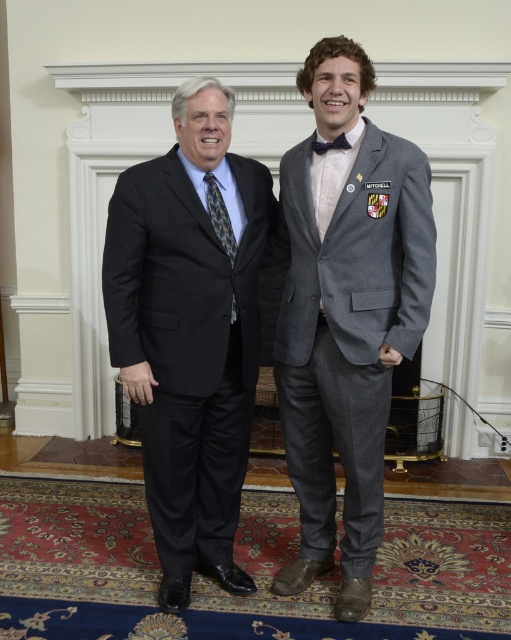
From the picture: You are a photographer setting up for a formal event. You notice the gray wool suit at right and the black wool suit at center in the frame. Which suit is closer to the camera?

The gray wool suit at right is in front of the black wool suit at center, so it is closer to the camera.

You are organizing a formal event and need to arrange two suits for display. The gray wool suit at right and the black wool suit at center are both in the same room. Based on their positions, which suit is placed higher up?

The gray wool suit at right is located above the black wool suit at center, so it is placed higher up.